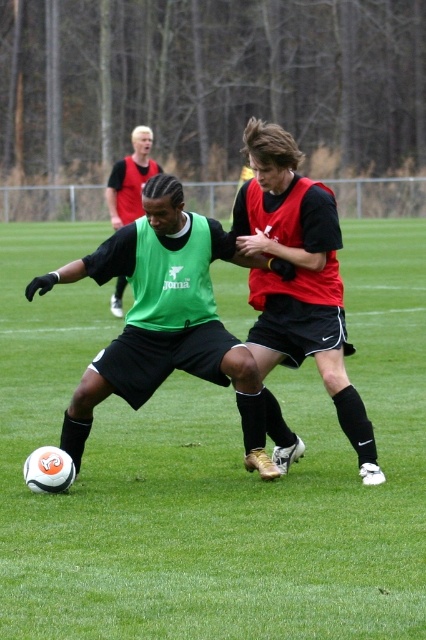
Question: Among these objects, which one is nearest to the camera?

Choices:
 (A) green matte soccer ball at lower left
 (B) red matte jersey at center
 (C) green matte jersey at center
 (D) green matte vest at center

Answer: (A)

Question: From the image, what is the correct spatial relationship of green matte soccer ball at lower left in relation to red matte jersey at center?

Choices:
 (A) right
 (B) left

Answer: (B)

Question: Which of these objects is positioned closest to the green matte vest at center?

Choices:
 (A) green matte soccer ball at lower left
 (B) green matte jersey at center

Answer: (B)

Question: Considering the relative positions of green matte soccer ball at lower left and red matte jersey at center in the image provided, where is green matte soccer ball at lower left located with respect to red matte jersey at center?

Choices:
 (A) above
 (B) below

Answer: (B)

Question: Among these points, which one is nearest to the camera?

Choices:
 (A) (97, 369)
 (B) (236, 208)
 (C) (129, 168)
 (D) (92, 292)

Answer: (A)

Question: Does green matte soccer ball at lower left have a lesser width compared to green matte vest at center?

Choices:
 (A) no
 (B) yes

Answer: (A)